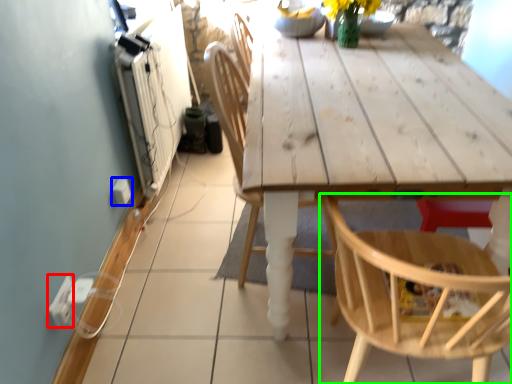
Question: Estimate the real-world distances between objects in this image. Which object is farther from electric outlet (highlighted by a red box), electric outlet (highlighted by a blue box) or chair (highlighted by a green box)?

Choices:
 (A) electric outlet
 (B) chair

Answer: (B)